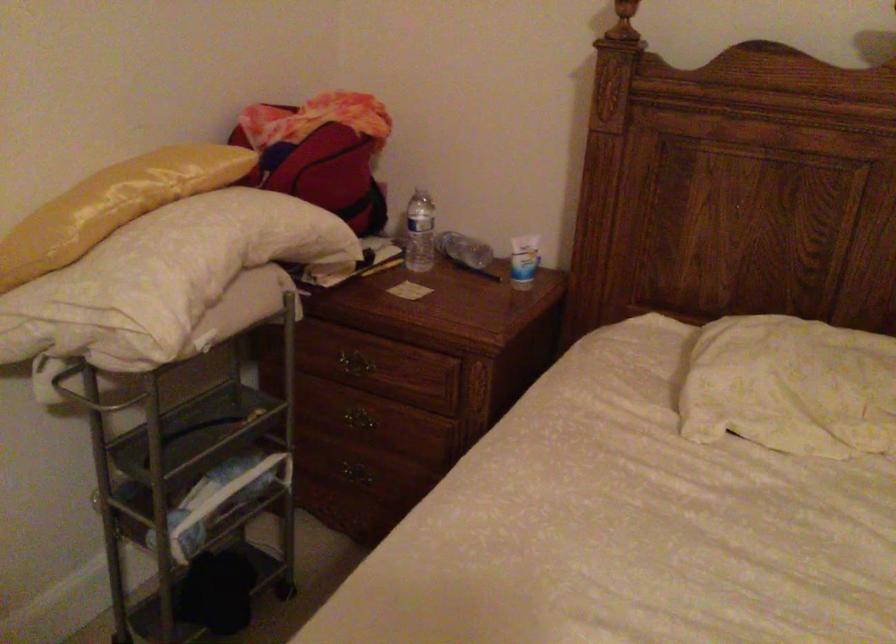
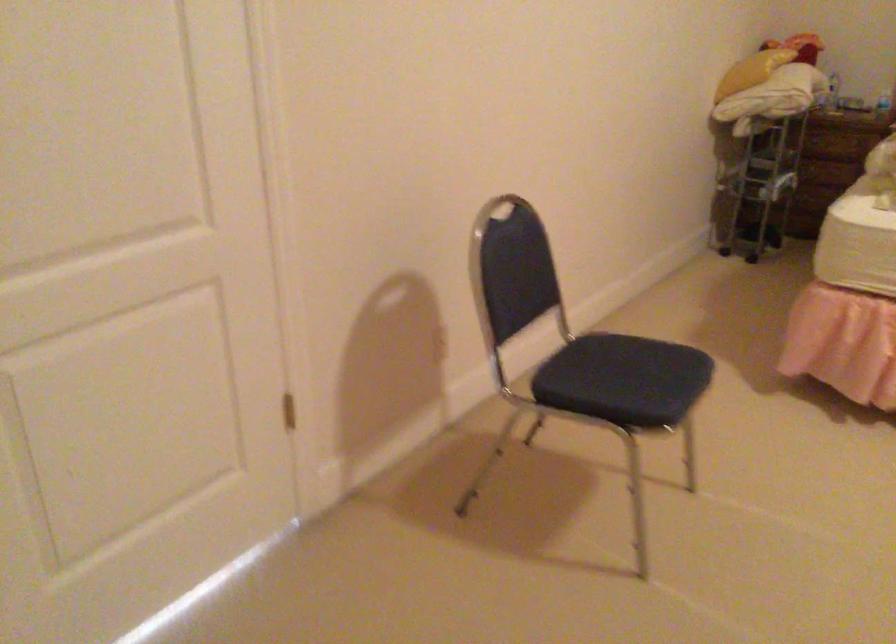
Consider the image. Which direction would the cameraman need to move to produce the second image?

The cameraman moved toward left, backward.